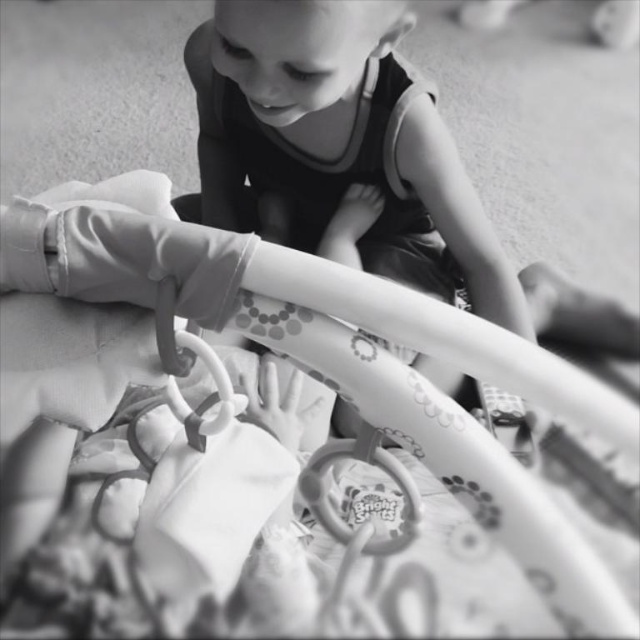
Looking at this image, between patterned plastic infant bed at center and rubber teething ring at center, which one is positioned lower?

rubber teething ring at center is below.

Is patterned plastic infant bed at center smaller than rubber teething ring at center?

Incorrect, patterned plastic infant bed at center is not smaller in size than rubber teething ring at center.

The height and width of the screenshot is (640, 640). What are the coordinates of `patterned plastic infant bed at center` in the screenshot? It's located at (440, 404).